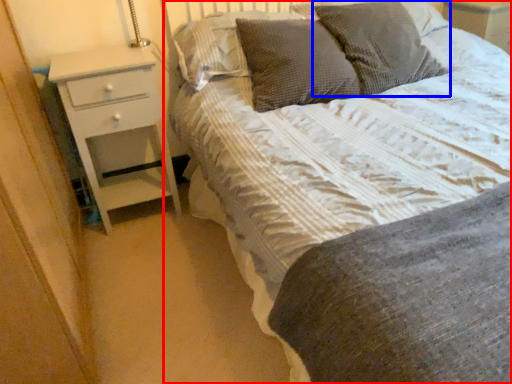
Question: Which point is further to the camera, bed (highlighted by a red box) or pillow (highlighted by a blue box)?

Choices:
 (A) bed
 (B) pillow

Answer: (B)